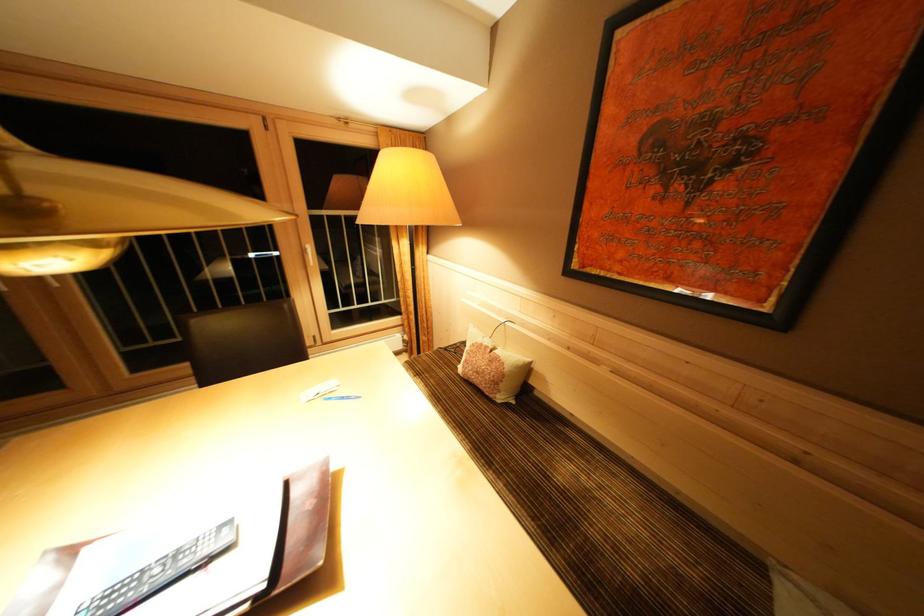
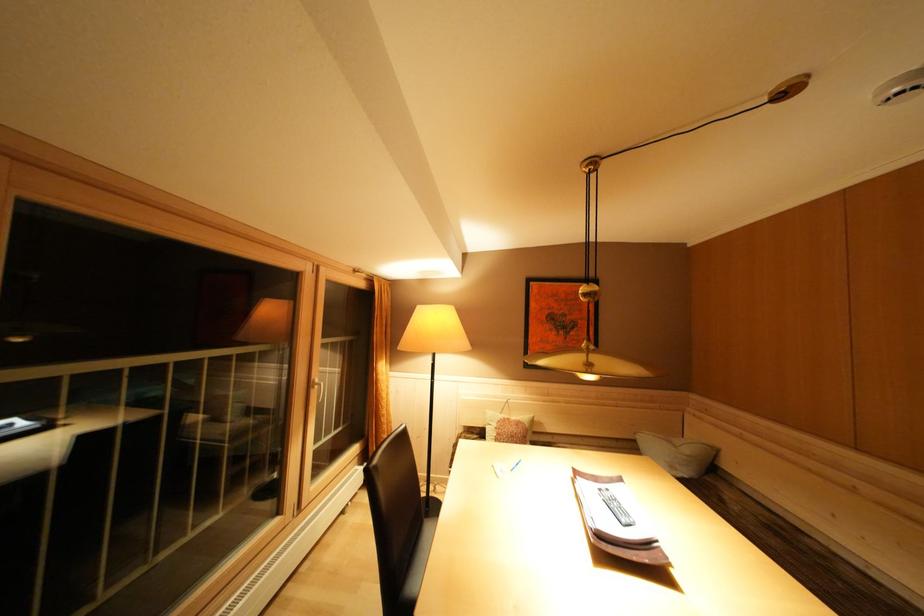
In the second image, find the point that corresponds to (493,352) in the first image.

(515, 424)